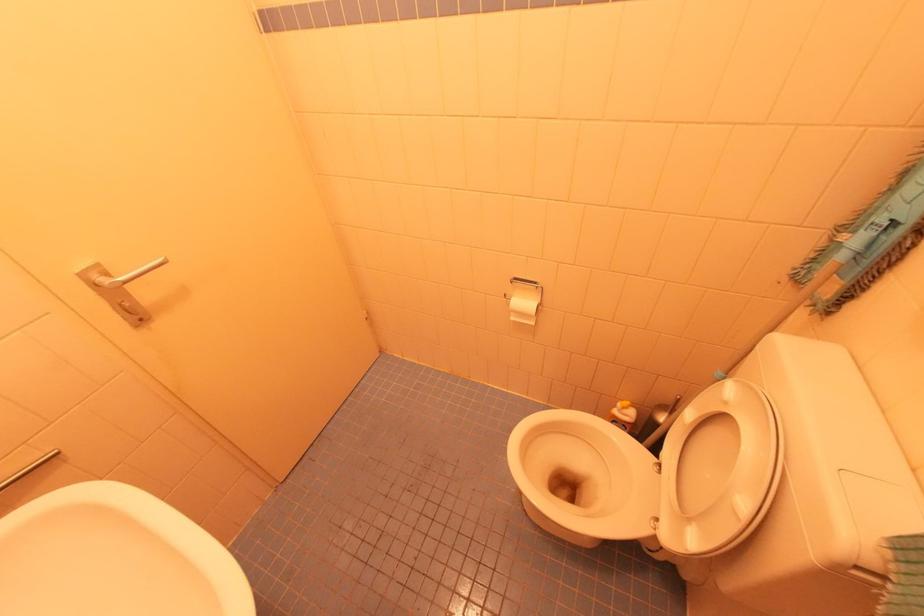
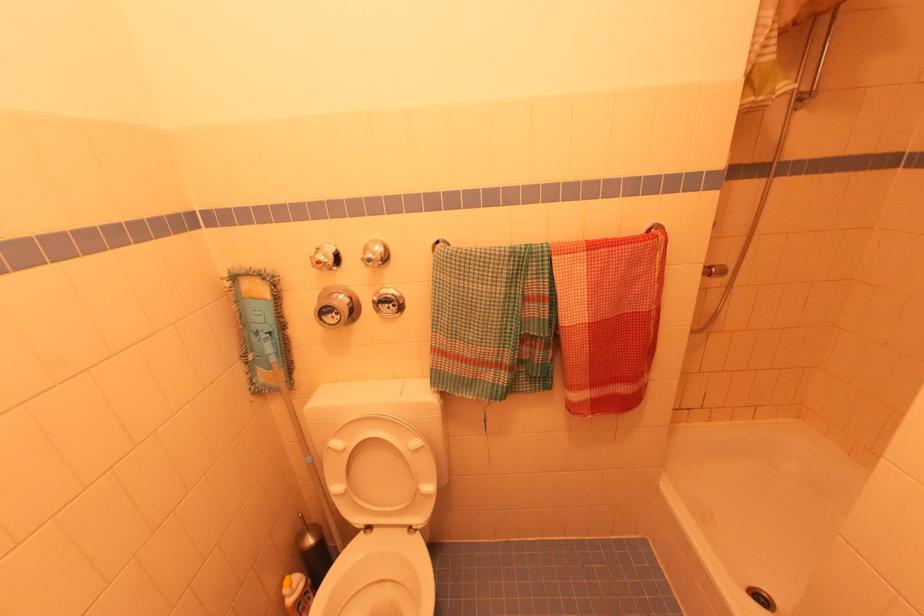
Locate, in the second image, the point that corresponds to (x=736, y=382) in the first image.

(334, 439)